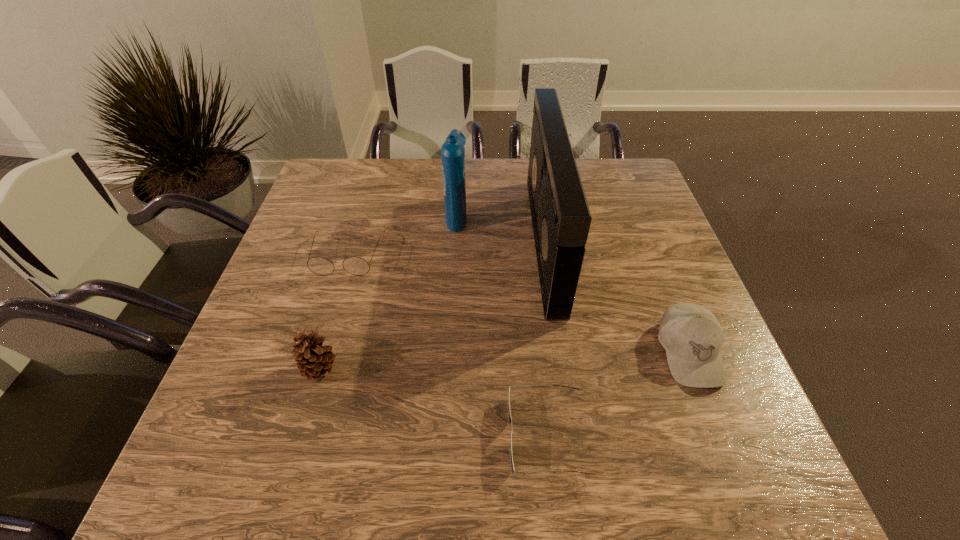
The image size is (960, 540). Identify the location of free space located 0.340m on the front side of the videotape. (x=406, y=242).

The height and width of the screenshot is (540, 960). What are the coordinates of `free space located on the back of the third object from left to right` in the screenshot? It's located at (459, 186).

Where is `vacant space situated on the right of the fourth shortest object`? The width and height of the screenshot is (960, 540). vacant space situated on the right of the fourth shortest object is located at coordinates (407, 369).

The width and height of the screenshot is (960, 540). I want to click on free space located on the front-facing side of the fourth tallest object, so click(x=720, y=431).

Locate an element on the screen. blank area located 0.060m on the temples of the second shortest object is located at coordinates (335, 296).

You are a GUI agent. You are given a task and a screenshot of the screen. Output one action in this format:
    pyautogui.click(x=<x>, y=<y>)
    Task: Click on the free space located 0.150m on the front-facing side of the sunglasses
    The height and width of the screenshot is (540, 960).
    Given the screenshot: What is the action you would take?
    pyautogui.click(x=426, y=436)

At what (x,y) coordinates should I click in order to perform the action: click on free spot located 0.240m on the front-facing side of the sunglasses. Please return your answer as a coordinate pair (x, y). Looking at the image, I should click on (377, 436).

Locate an element on the screen. Image resolution: width=960 pixels, height=540 pixels. vacant space located 0.280m on the front-facing side of the sunglasses is located at coordinates (355, 436).

Locate an element on the screen. videotape situated at the far edge is located at coordinates (561, 219).

Where is `shampoo situated at the far edge`? The image size is (960, 540). shampoo situated at the far edge is located at coordinates (452, 151).